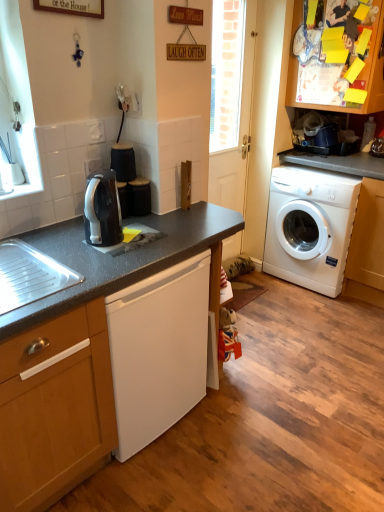
Find the location of a particular element. Image resolution: width=384 pixels, height=512 pixels. free space in front of black glossy kettle at upper left is located at coordinates (109, 258).